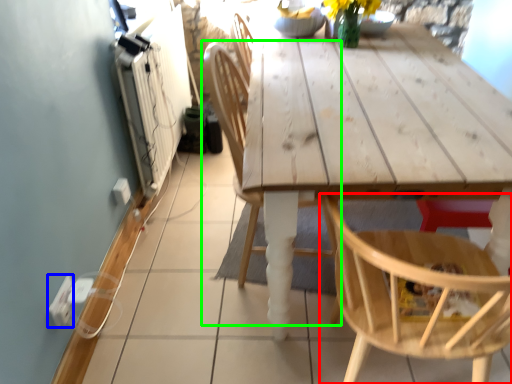
Question: Estimate the real-world distances between objects in this image. Which object is farther from chair (highlighted by a red box), electric outlet (highlighted by a blue box) or chair (highlighted by a green box)?

Choices:
 (A) electric outlet
 (B) chair

Answer: (A)